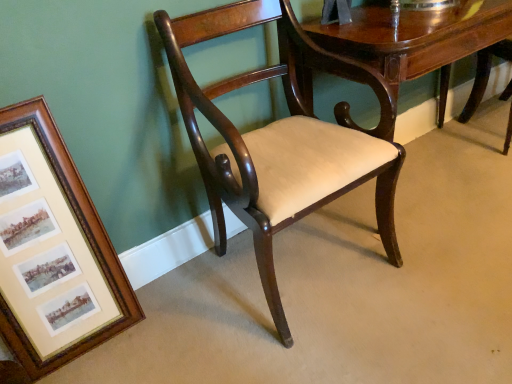
Question: Is mahogany wood chair at center at the left side of wooden framed prints at left?

Choices:
 (A) yes
 (B) no

Answer: (B)

Question: From the image's perspective, is mahogany wood chair at center beneath wooden framed prints at left?

Choices:
 (A) no
 (B) yes

Answer: (A)

Question: Can you confirm if mahogany wood chair at center is bigger than wooden framed prints at left?

Choices:
 (A) no
 (B) yes

Answer: (B)

Question: Does mahogany wood chair at center have a greater width compared to wooden framed prints at left?

Choices:
 (A) no
 (B) yes

Answer: (B)

Question: Considering the relative sizes of mahogany wood chair at center and wooden framed prints at left in the image provided, is mahogany wood chair at center thinner than wooden framed prints at left?

Choices:
 (A) no
 (B) yes

Answer: (A)

Question: Is mahogany wood table at center inside the boundaries of wooden framed prints at left, or outside?

Choices:
 (A) outside
 (B) inside

Answer: (A)

Question: Is point (371, 44) positioned closer to the camera than point (5, 243)?

Choices:
 (A) farther
 (B) closer

Answer: (A)

Question: Is mahogany wood table at center taller or shorter than wooden framed prints at left?

Choices:
 (A) short
 (B) tall

Answer: (A)

Question: In the image, is mahogany wood table at center on the left side or the right side of wooden framed prints at left?

Choices:
 (A) right
 (B) left

Answer: (A)

Question: Is wooden framed prints at left bigger or smaller than mahogany wood chair at center?

Choices:
 (A) small
 (B) big

Answer: (A)

Question: Is wooden framed prints at left situated inside mahogany wood chair at center or outside?

Choices:
 (A) inside
 (B) outside

Answer: (B)

Question: From their relative heights in the image, would you say wooden framed prints at left is taller or shorter than mahogany wood chair at center?

Choices:
 (A) tall
 (B) short

Answer: (B)

Question: From a real-world perspective, is wooden framed prints at left positioned above or below mahogany wood chair at center?

Choices:
 (A) above
 (B) below

Answer: (B)

Question: Considering the positions of wooden framed prints at left and mahogany wood table at center in the image, is wooden framed prints at left wider or thinner than mahogany wood table at center?

Choices:
 (A) thin
 (B) wide

Answer: (A)

Question: Considering the positions of wooden framed prints at left and mahogany wood table at center in the image, is wooden framed prints at left bigger or smaller than mahogany wood table at center?

Choices:
 (A) big
 (B) small

Answer: (B)